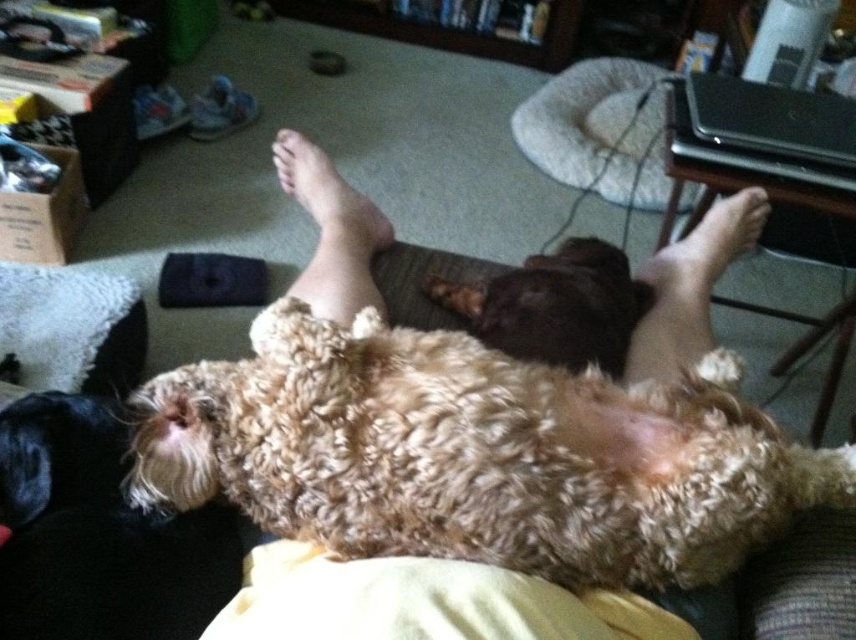
Question: Can you confirm if fuzzy brown dog at center is bigger than brown furry foot at lower right?

Choices:
 (A) no
 (B) yes

Answer: (B)

Question: Considering the real-world distances, which object is closest to the brown curly fur dog at center?

Choices:
 (A) fuzzy brown dog at center
 (B) brown furry foot at lower right

Answer: (B)

Question: Among these points, which one is farthest from the camera?

Choices:
 (A) (747, 209)
 (B) (634, 282)
 (C) (325, 541)
 (D) (391, 228)

Answer: (D)

Question: Does fuzzy brown dog at center appear over beige plush dog bed at upper center?

Choices:
 (A) no
 (B) yes

Answer: (A)

Question: Which of the following is the farthest from the observer?

Choices:
 (A) (443, 547)
 (B) (629, 131)

Answer: (B)

Question: Can you confirm if fuzzy brown dog at center is smaller than brown furry foot at lower right?

Choices:
 (A) no
 (B) yes

Answer: (A)